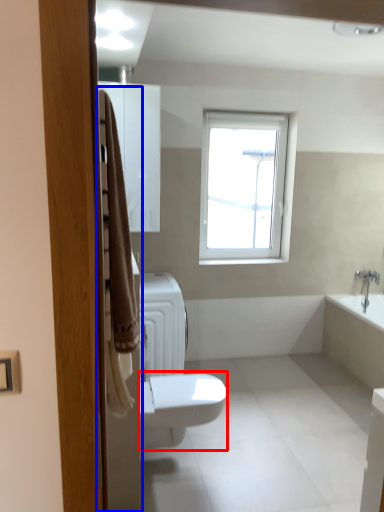
Question: Which of the following is the farthest to the observer, bidet (highlighted by a red box) or screen door (highlighted by a blue box)?

Choices:
 (A) bidet
 (B) screen door

Answer: (A)